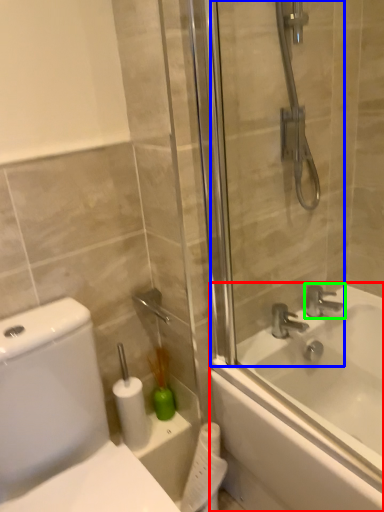
Question: Which is farther away from bathtub (highlighted by a red box)? screen door (highlighted by a blue box) or tap (highlighted by a green box)?

Choices:
 (A) screen door
 (B) tap

Answer: (A)